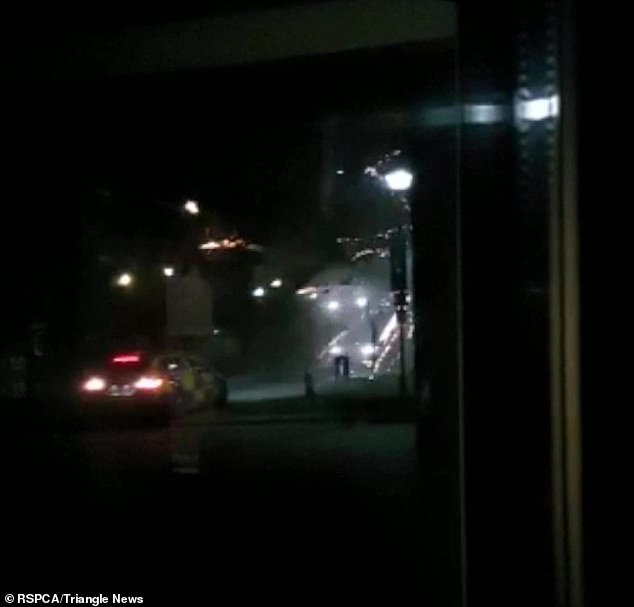
You are a GUI agent. You are given a task and a screenshot of the screen. Output one action in this format:
    pyautogui.click(x=<x>, y=<y>)
    Task: Click on the lamp
    Image resolution: width=634 pixels, height=607 pixels.
    Given the screenshot: What is the action you would take?
    pyautogui.click(x=110, y=294), pyautogui.click(x=399, y=240)